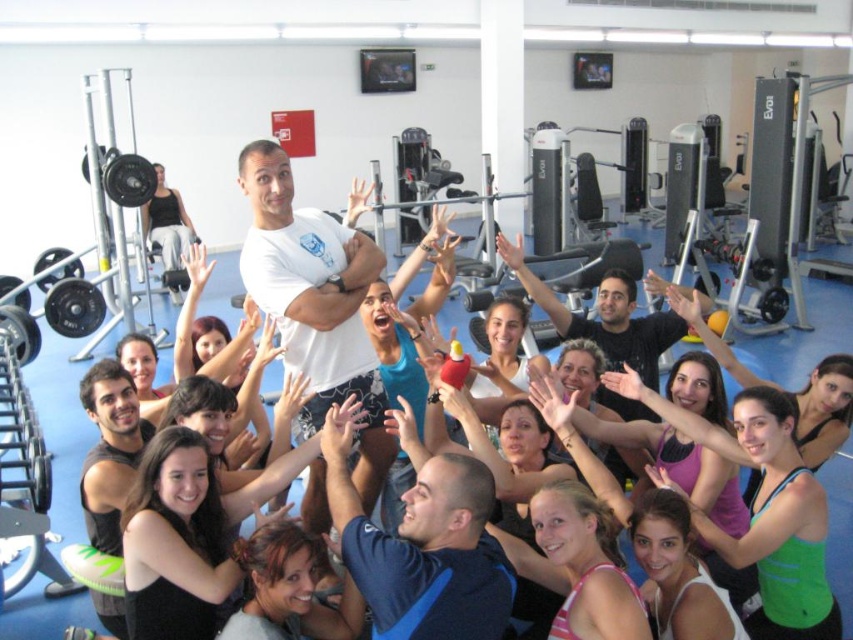
Which is behind, point (280, 156) or point (477, 541)?

The point (280, 156) is behind.

Is white matte t-shirt at center in front of blue fabric shirt at center?

No, it is not.

What do you see at coordinates (315, 301) in the screenshot?
I see `white matte t-shirt at center` at bounding box center [315, 301].

The height and width of the screenshot is (640, 853). In order to click on white matte t-shirt at center in this screenshot , I will do `click(315, 301)`.

Can you confirm if purple fabric arm at center is bigger than matte black arm at center?

Actually, purple fabric arm at center might be smaller than matte black arm at center.

Based on the photo, who is shorter, purple fabric arm at center or matte black arm at center?

With less height is purple fabric arm at center.

Identify the location of purple fabric arm at center. The width and height of the screenshot is (853, 640). (677, 417).

Describe the element at coordinates (422, 547) in the screenshot. I see `blue fabric shirt at center` at that location.

Consider the image. Who is more forward, (334, 476) or (567, 310)?

Positioned in front is point (334, 476).

Where is `blue fabric shirt at center`? This screenshot has width=853, height=640. blue fabric shirt at center is located at coordinates (422, 547).